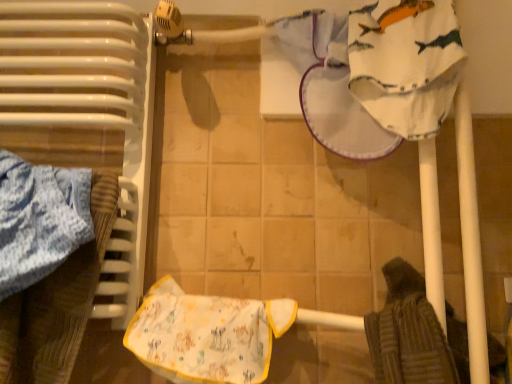
Question: In the image, is printed fabric bib at center positioned in front of or behind white glossy radiator at left?

Choices:
 (A) front
 (B) behind

Answer: (B)

Question: Looking at their shapes, would you say printed fabric bib at center is wider or thinner than white glossy radiator at left?

Choices:
 (A) thin
 (B) wide

Answer: (A)

Question: Considering the positions of printed fabric bib at center and white glossy radiator at left in the image, is printed fabric bib at center bigger or smaller than white glossy radiator at left?

Choices:
 (A) small
 (B) big

Answer: (A)

Question: Considering the positions of white glossy radiator at left and printed fabric bib at center in the image, is white glossy radiator at left wider or thinner than printed fabric bib at center?

Choices:
 (A) thin
 (B) wide

Answer: (B)

Question: Considering their positions, is white glossy radiator at left located in front of or behind printed fabric bib at center?

Choices:
 (A) front
 (B) behind

Answer: (A)

Question: Would you say white glossy radiator at left is to the left or to the right of printed fabric bib at center in the picture?

Choices:
 (A) right
 (B) left

Answer: (B)

Question: In terms of size, does white glossy radiator at left appear bigger or smaller than printed fabric bib at center?

Choices:
 (A) small
 (B) big

Answer: (B)